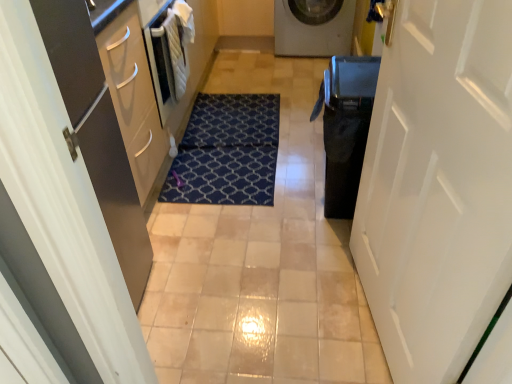
Question: Is point (251, 185) positioned closer to the camera than point (354, 119)?

Choices:
 (A) closer
 (B) farther

Answer: (B)

Question: Visually, is blue patterned mat at center positioned to the left or to the right of black glossy dishwasher at right?

Choices:
 (A) left
 (B) right

Answer: (A)

Question: Considering the real-world distances, which object is farthest from the matte white door at left, the first door in the left-to-right sequence?

Choices:
 (A) white glossy washing machine at upper center
 (B) blue patterned mat at center
 (C) white matte door at right, the first door from the right
 (D) black glossy dishwasher at right
 (E) gold metallic door handle at upper right

Answer: (A)

Question: Estimate the real-world distances between objects in this image. Which object is farther from the white matte door at right, which ranks as the second door in left-to-right order?

Choices:
 (A) black glossy dishwasher at right
 (B) white glossy washing machine at upper center
 (C) matte white door at left, placed as the second door when sorted from right to left
 (D) gold metallic door handle at upper right
 (E) blue patterned mat at center

Answer: (B)